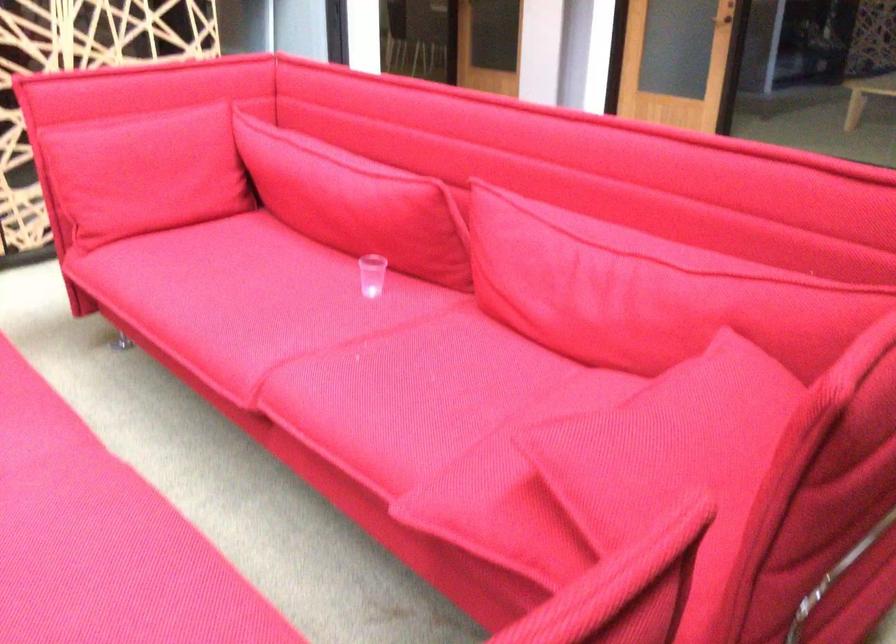
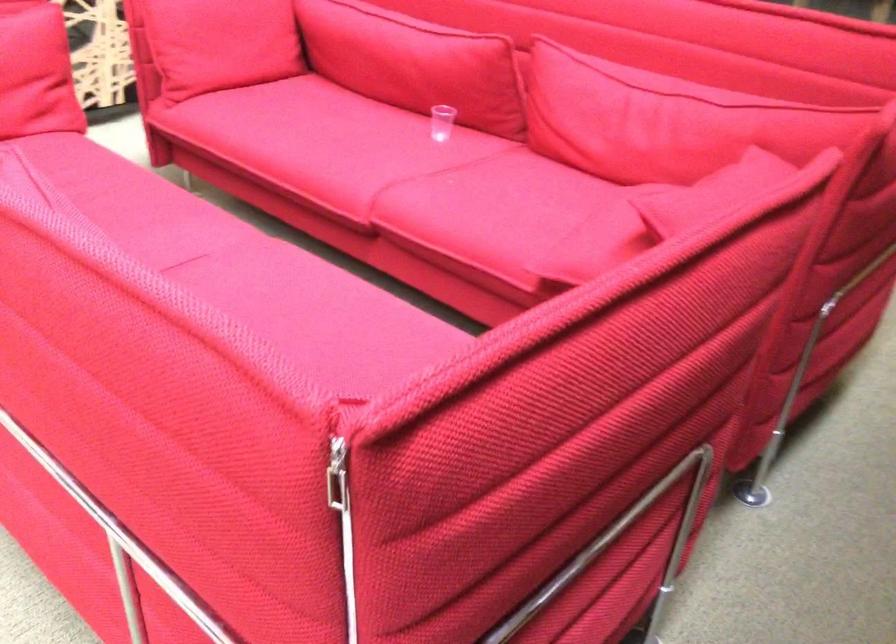
Where in the second image is the point corresponding to the point at 349,207 from the first image?

(414, 62)